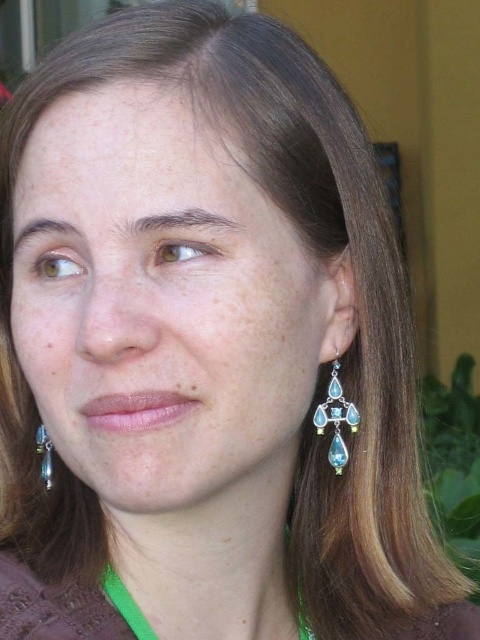
Does shiny silver earrings at right have a lesser width compared to shiny silver earring at lower left?

Incorrect, shiny silver earrings at right's width is not less than shiny silver earring at lower left's.

Which is in front, point (325, 412) or point (39, 426)?

Point (325, 412) is more forward.

In order to click on shiny silver earrings at right in this screenshot , I will do `click(336, 419)`.